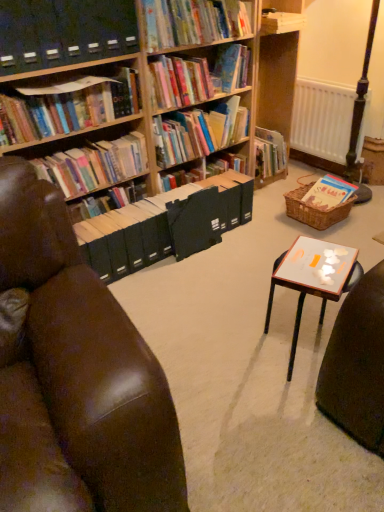
Question: Does hardcover books at left, arranged as the 5th book when viewed from the right, have a lesser width compared to hardcover books at upper center, the fifth book viewed from the left?

Choices:
 (A) yes
 (B) no

Answer: (A)

Question: Is hardcover books at left, placed as the 2th book when sorted from left to right, at the right side of hardcover books at upper center, which ranks as the 2th book in right-to-left order?

Choices:
 (A) no
 (B) yes

Answer: (A)

Question: Is hardcover books at left, placed as the 2th book when sorted from left to right, oriented towards hardcover books at upper center, which ranks as the 2th book in right-to-left order?

Choices:
 (A) no
 (B) yes

Answer: (A)

Question: Does hardcover books at left, placed as the 2th book when sorted from left to right, have a larger size compared to hardcover books at upper center, the fifth book viewed from the left?

Choices:
 (A) yes
 (B) no

Answer: (B)

Question: Is hardcover books at left, arranged as the 5th book when viewed from the right, behind hardcover books at upper center, the fifth book viewed from the left?

Choices:
 (A) no
 (B) yes

Answer: (A)

Question: From a real-world perspective, is hardcover books at left, arranged as the 5th book when viewed from the right, below hardcover books at upper center, which ranks as the 2th book in right-to-left order?

Choices:
 (A) no
 (B) yes

Answer: (B)

Question: From a real-world perspective, is black plastic shelf at upper left over brown leather chair at left?

Choices:
 (A) yes
 (B) no

Answer: (A)

Question: Considering the relative sizes of black plastic shelf at upper left and brown leather chair at left in the image provided, is black plastic shelf at upper left smaller than brown leather chair at left?

Choices:
 (A) no
 (B) yes

Answer: (B)

Question: From a real-world perspective, is black plastic shelf at upper left under brown leather chair at left?

Choices:
 (A) no
 (B) yes

Answer: (A)

Question: From the image's perspective, is black plastic shelf at upper left below brown leather chair at left?

Choices:
 (A) no
 (B) yes

Answer: (A)

Question: Is black plastic shelf at upper left taller than brown leather chair at left?

Choices:
 (A) no
 (B) yes

Answer: (A)

Question: Is black plastic shelf at upper left touching brown leather chair at left?

Choices:
 (A) no
 (B) yes

Answer: (A)

Question: Is the position of brown leather chair at left more distant than that of hardcover books at left, arranged as the 5th book when viewed from the right?

Choices:
 (A) no
 (B) yes

Answer: (A)